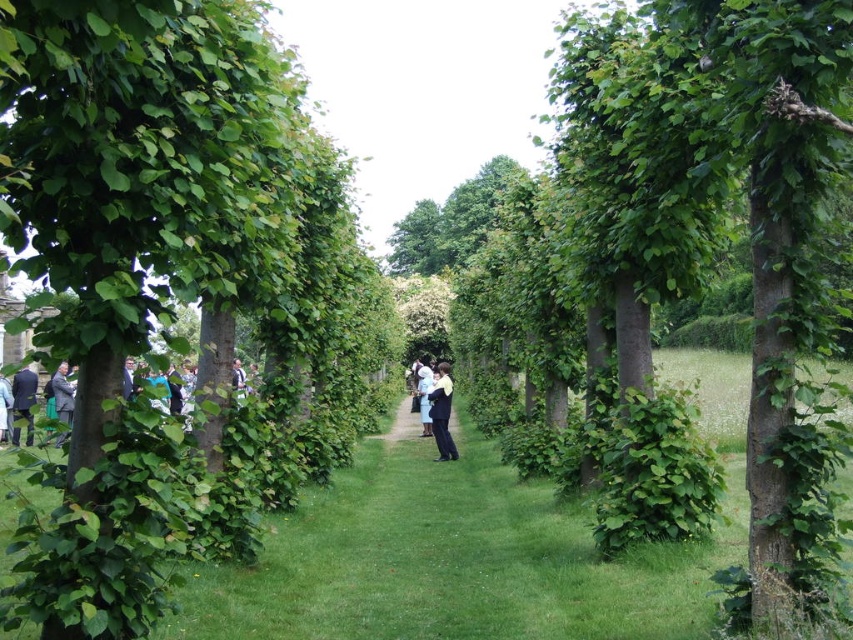
Question: Which point is closer to the camera taking this photo?

Choices:
 (A) pos(35,612)
 (B) pos(10,509)
 (C) pos(1,433)
 (D) pos(428,376)

Answer: (A)

Question: Can you confirm if black smooth suit at center is smaller than white fabric at center?

Choices:
 (A) yes
 (B) no

Answer: (A)

Question: Considering the real-world distances, which object is farthest from the green leafy tree at center?

Choices:
 (A) green grass at center
 (B) light blue fabric at center
 (C) dark gray suit at left

Answer: (B)

Question: Does black smooth suit at center appear on the left side of light blue fabric at center?

Choices:
 (A) yes
 (B) no

Answer: (B)

Question: Is white fabric at center wider than light blue fabric at center?

Choices:
 (A) yes
 (B) no

Answer: (A)

Question: Which of the following is the closest to the observer?

Choices:
 (A) white fabric at center
 (B) green leafy tree at center

Answer: (B)